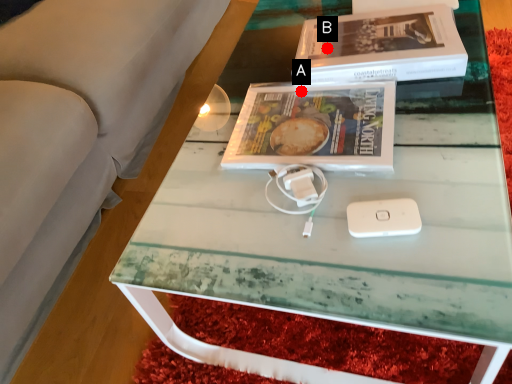
Question: Two points are circled on the image, labeled by A and B beside each circle. Which point appears farthest from the camera in this image?

Choices:
 (A) A is further
 (B) B is further

Answer: (B)